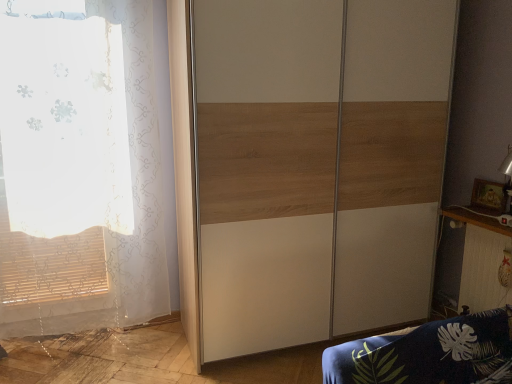
Question: Is wooden/textured wardrobe at center shorter than wooden table at right?

Choices:
 (A) no
 (B) yes

Answer: (A)

Question: Is wooden/textured wardrobe at center positioned far away from wooden table at right?

Choices:
 (A) no
 (B) yes

Answer: (A)

Question: Does wooden/textured wardrobe at center turn towards wooden table at right?

Choices:
 (A) yes
 (B) no

Answer: (A)

Question: From the image's perspective, is wooden/textured wardrobe at center under wooden table at right?

Choices:
 (A) no
 (B) yes

Answer: (A)

Question: Is wooden/textured wardrobe at center positioned behind wooden table at right?

Choices:
 (A) yes
 (B) no

Answer: (B)

Question: Is wooden/textured wardrobe at center turned away from wooden table at right?

Choices:
 (A) no
 (B) yes

Answer: (A)

Question: Can you confirm if white sheer curtain at left is positioned to the right of wooden/textured wardrobe at center?

Choices:
 (A) no
 (B) yes

Answer: (A)

Question: Does white sheer curtain at left appear on the left side of wooden/textured wardrobe at center?

Choices:
 (A) yes
 (B) no

Answer: (A)

Question: Does white sheer curtain at left lie in front of wooden/textured wardrobe at center?

Choices:
 (A) yes
 (B) no

Answer: (B)

Question: Is white sheer curtain at left completely or partially outside of wooden/textured wardrobe at center?

Choices:
 (A) yes
 (B) no

Answer: (A)

Question: From the image's perspective, is white sheer curtain at left under wooden/textured wardrobe at center?

Choices:
 (A) no
 (B) yes

Answer: (B)

Question: Does white sheer curtain at left contain wooden/textured wardrobe at center?

Choices:
 (A) no
 (B) yes

Answer: (A)

Question: Considering the relative sizes of wooden table at right and white sheer curtain at left in the image provided, is wooden table at right shorter than white sheer curtain at left?

Choices:
 (A) yes
 (B) no

Answer: (A)